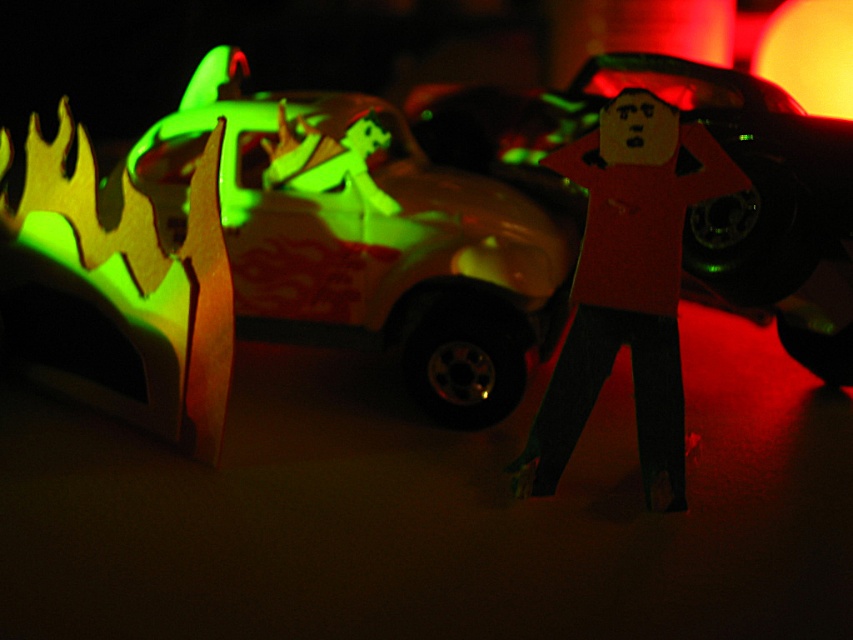
You are an artist setting up an art installation. You have a fluorescent yellow cardboard flames at left and a cardboard figure at center. According to the scene, which object is positioned to the left of the other?

The fluorescent yellow cardboard flames at left are to the left of the cardboard figure at center.

You are a child trying to place a sticker on either the fluorescent yellow cardboard flames at left or the cardboard figure at center. If you want to place the sticker on the wider object, which one should you choose?

You should choose the fluorescent yellow cardboard flames at left because its width is larger than the cardboard figure at center.

You are an artist setting up an installation. You have a glowing plastic car at center and fluorescent yellow cardboard flames at left. According to the scene, where should you place the car relative to the flames to match the image?

The glowing plastic car at center should be placed above the fluorescent yellow cardboard flames at left to match the image.